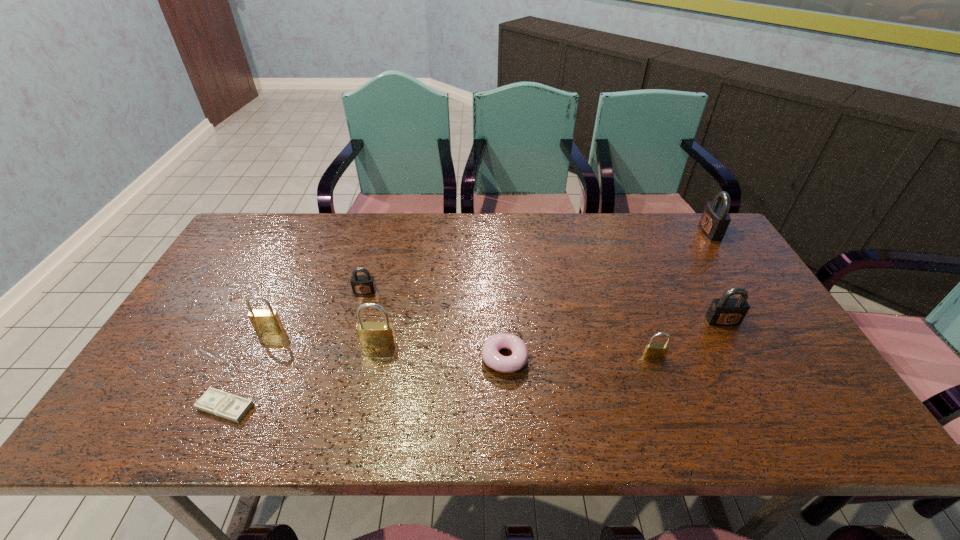
Locate which brass padlock is the second closest to the biggest brass padlock. Please provide its 2D coordinates. Your answer should be formatted as a tuple, i.e. [(x, y)], where the tuple contains the x and y coordinates of a point satisfying the conditions above.

[(653, 351)]

Select which brass padlock is the second closest to the second nearest gray padlock. Please provide its 2D coordinates. Your answer should be formatted as a tuple, i.e. [(x, y)], where the tuple contains the x and y coordinates of a point satisfying the conditions above.

[(262, 320)]

I want to click on free space that satisfies the following two spatial constraints: 1. on the front-facing side of the leftmost padlock; 2. on the left side of the purple doughnut, so click(255, 358).